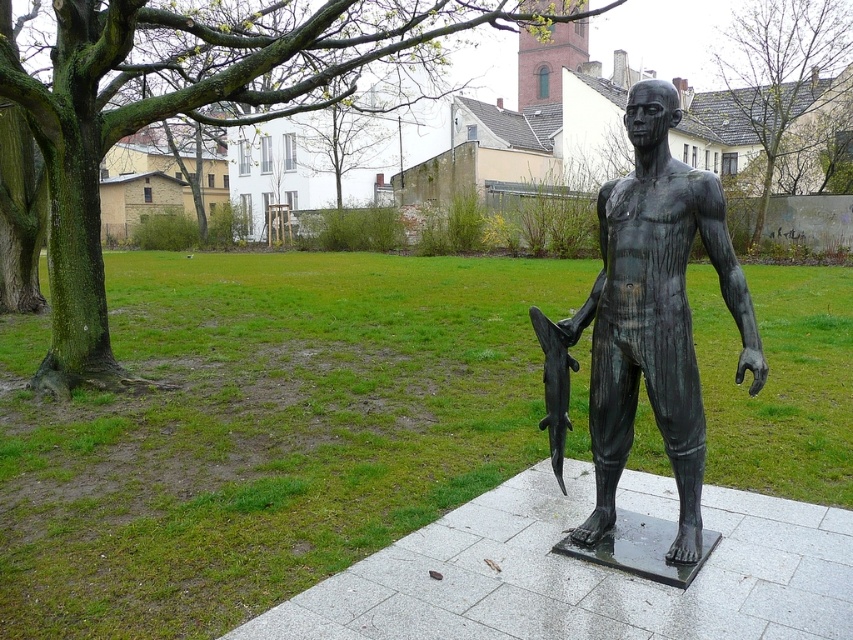
Question: Does bronze statue at center appear over polished bronze shark at lower right?

Choices:
 (A) no
 (B) yes

Answer: (B)

Question: Among these objects, which one is farthest from the camera?

Choices:
 (A) polished bronze shark at lower right
 (B) bronze statue at center

Answer: (A)

Question: Is bronze statue at center wider than polished bronze shark at lower right?

Choices:
 (A) yes
 (B) no

Answer: (A)

Question: Which point is closer to the camera taking this photo?

Choices:
 (A) (624, 346)
 (B) (554, 396)

Answer: (A)

Question: Which of the following is the closest to the observer?

Choices:
 (A) (659, 424)
 (B) (563, 385)

Answer: (A)

Question: Can you confirm if bronze statue at center is bigger than polished bronze shark at lower right?

Choices:
 (A) no
 (B) yes

Answer: (B)